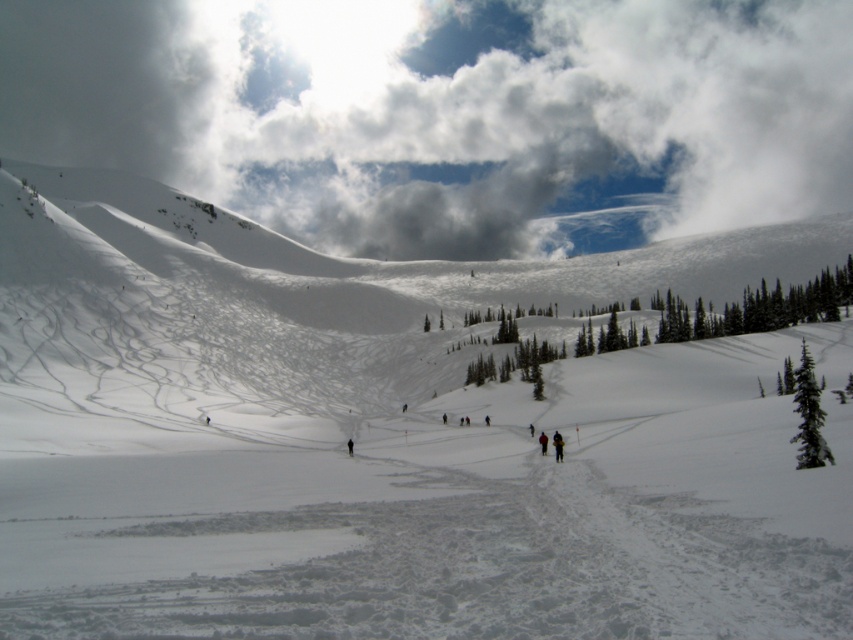
Consider the image. Is cloudy sky at upper center positioned before yellow jacket at center?

No, cloudy sky at upper center is further to the viewer.

From the picture: Which is below, cloudy sky at upper center or yellow jacket at center?

yellow jacket at center is below.

Locate an element on the screen. This screenshot has width=853, height=640. cloudy sky at upper center is located at coordinates (447, 115).

Which is below, black fabric person at lower right or yellow jacket at center?

yellow jacket at center is below.

Does black fabric person at lower right lie in front of yellow jacket at center?

Yes, it is.

Where is `black fabric person at lower right`? black fabric person at lower right is located at coordinates (556, 445).

Who is positioned more to the left, cloudy sky at upper center or black fabric person at lower right?

Positioned to the left is cloudy sky at upper center.

Based on the photo, which is above, cloudy sky at upper center or black fabric person at lower right?

cloudy sky at upper center is above.

Measure the distance between cloudy sky at upper center and camera.

→ cloudy sky at upper center is 570.39 meters away from camera.

At what (x,y) coordinates should I click in order to perform the action: click on cloudy sky at upper center. Please return your answer as a coordinate pair (x, y). Looking at the image, I should click on (447, 115).